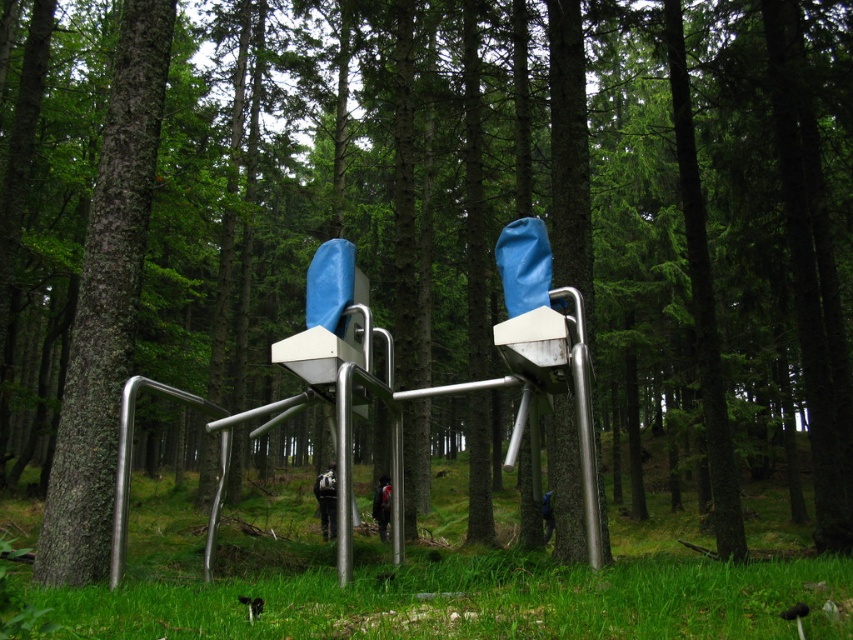
Question: From the image, what is the correct spatial relationship of green grass at center in relation to smooth brown tree trunk at left?

Choices:
 (A) above
 (B) below

Answer: (B)

Question: Which of the following is the closest to the observer?

Choices:
 (A) green grass at center
 (B) smooth brown tree trunk at left

Answer: (A)

Question: Is green grass at center smaller than smooth brown tree trunk at left?

Choices:
 (A) no
 (B) yes

Answer: (A)

Question: Observing the image, what is the correct spatial positioning of green grass at center in reference to smooth brown tree trunk at left?

Choices:
 (A) left
 (B) right

Answer: (B)

Question: Which point is farther from the camera taking this photo?

Choices:
 (A) (740, 627)
 (B) (142, 68)

Answer: (B)